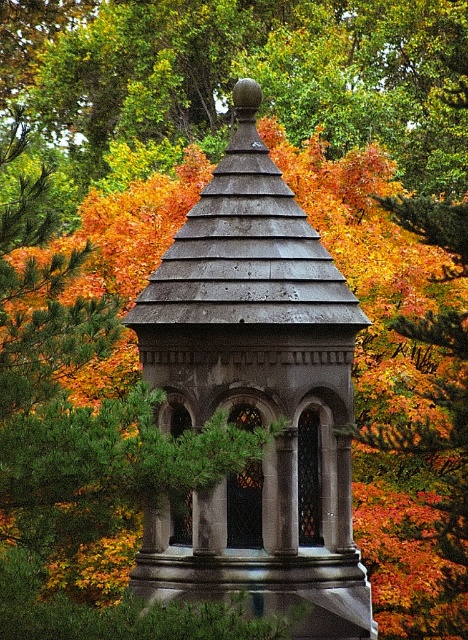
Does point (182, 362) lie in front of point (246, 60)?

Yes, it is.

Image resolution: width=468 pixels, height=640 pixels. I want to click on gray stone gazebo at center, so click(x=255, y=397).